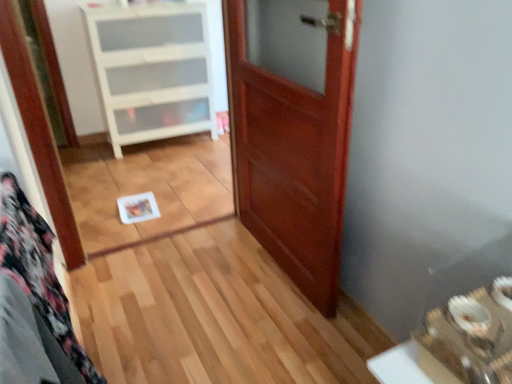
Question: From a real-world perspective, does white plastic cabinet at upper left sit lower than mahogany wood door at center?

Choices:
 (A) no
 (B) yes

Answer: (B)

Question: Is white plastic cabinet at upper left thinner than mahogany wood door at center?

Choices:
 (A) yes
 (B) no

Answer: (B)

Question: From the image's perspective, is white plastic cabinet at upper left on mahogany wood door at center?

Choices:
 (A) no
 (B) yes

Answer: (B)

Question: Is white plastic cabinet at upper left behind mahogany wood door at center?

Choices:
 (A) yes
 (B) no

Answer: (A)

Question: Is white plastic cabinet at upper left far away from mahogany wood door at center?

Choices:
 (A) yes
 (B) no

Answer: (A)

Question: Is white plastic cabinet at upper left aimed at mahogany wood door at center?

Choices:
 (A) yes
 (B) no

Answer: (A)

Question: Is mahogany wood door at center far from white plastic cabinet at upper left?

Choices:
 (A) no
 (B) yes

Answer: (B)

Question: From the image's perspective, is mahogany wood door at center on white plastic cabinet at upper left?

Choices:
 (A) no
 (B) yes

Answer: (A)

Question: Is white plastic cabinet at upper left a part of mahogany wood door at center?

Choices:
 (A) no
 (B) yes

Answer: (A)

Question: Is mahogany wood door at center not within white plastic cabinet at upper left?

Choices:
 (A) yes
 (B) no

Answer: (A)

Question: Considering the relative positions of mahogany wood door at center and white plastic cabinet at upper left in the image provided, is mahogany wood door at center to the right of white plastic cabinet at upper left from the viewer's perspective?

Choices:
 (A) yes
 (B) no

Answer: (A)

Question: Is mahogany wood door at center to the left of white plastic cabinet at upper left from the viewer's perspective?

Choices:
 (A) no
 (B) yes

Answer: (A)

Question: From the image's perspective, is mahogany wood door at center positioned above or below white plastic cabinet at upper left?

Choices:
 (A) above
 (B) below

Answer: (B)